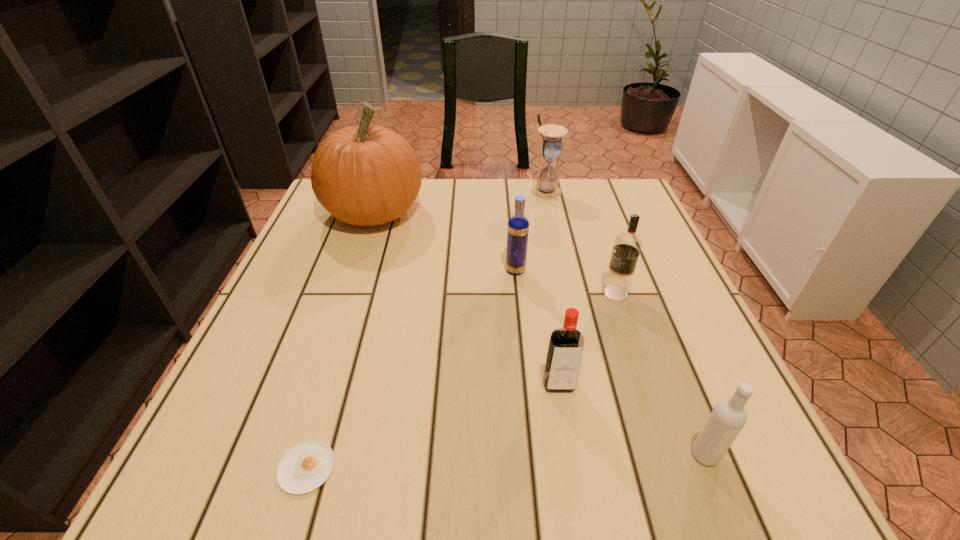
The height and width of the screenshot is (540, 960). Identify the location of the tallest object. (367, 175).

Locate an element on the screen. The image size is (960, 540). hourglass is located at coordinates (551, 145).

In order to click on the third vodka from left to right in this screenshot , I will do `click(627, 246)`.

Locate an element on the screen. the fourth farthest object is located at coordinates (627, 246).

The image size is (960, 540). Identify the location of the third farthest object. (518, 226).

At what (x,y) coordinates should I click in order to perform the action: click on the farthest vodka. Please return your answer as a coordinate pair (x, y). The width and height of the screenshot is (960, 540). Looking at the image, I should click on (518, 226).

The height and width of the screenshot is (540, 960). Identify the location of the third vodka from right to left. (565, 349).

Image resolution: width=960 pixels, height=540 pixels. Identify the location of the third farthest vodka. (565, 349).

Identify the location of the rightmost vodka. (727, 419).

I want to click on the nearest vodka, so click(x=727, y=419).